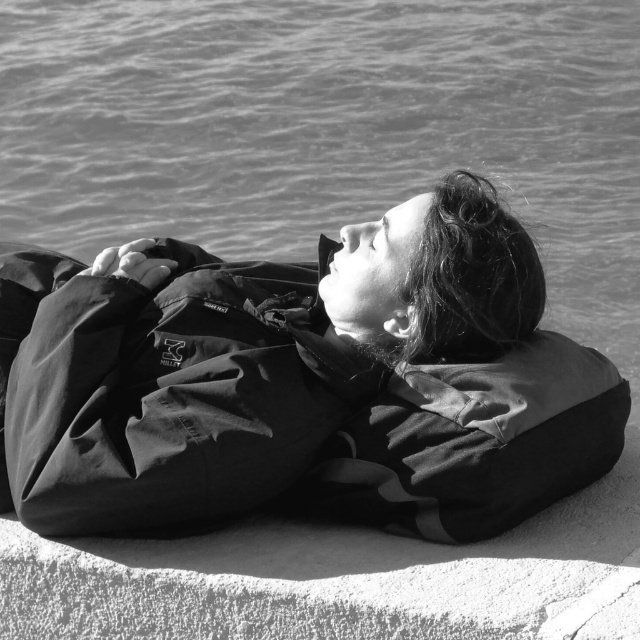
You are standing at the point with coordinates point [504,221] and want to look at the point with coordinates point [161,147]. Can you see it clearly? Explain why or why not based on their positions.

Point [161,147] is behind point [504,221], so you cannot see it clearly because it is obstructed by the point in front.

You are a photographer analyzing the composition of this black and white photo. You notice a point at coordinates (330,129). Based on the scene, what does this point likely represent?

The point at coordinates (330,129) likely represents smooth water at upper center as described in the scene.